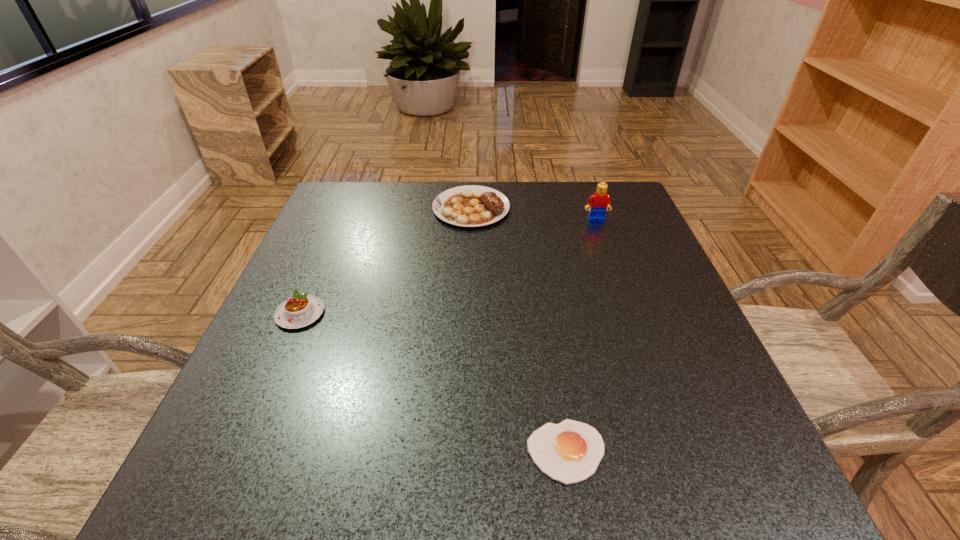
This screenshot has width=960, height=540. I want to click on the tallest object, so click(x=600, y=201).

Locate an element on the screen. The width and height of the screenshot is (960, 540). Lego is located at coordinates (600, 201).

Locate an element on the screen. steak is located at coordinates (469, 206).

The height and width of the screenshot is (540, 960). In order to click on the leftmost object in this screenshot , I will do point(298,311).

You are a GUI agent. You are given a task and a screenshot of the screen. Output one action in this format:
    pyautogui.click(x=<x>, y=<y>)
    Task: Click on the third tallest object
    
    Given the screenshot: What is the action you would take?
    pyautogui.click(x=298, y=311)

The width and height of the screenshot is (960, 540). What are the coordinates of `egg yolk` in the screenshot? It's located at (569, 452).

At what (x,y) coordinates should I click in order to perform the action: click on the nearest object. Please return your answer as a coordinate pair (x, y). The height and width of the screenshot is (540, 960). Looking at the image, I should click on (569, 452).

Identify the location of free space located 0.120m on the front-facing side of the Lego. tap(608, 252).

Where is `free location located on the front of the steak`? free location located on the front of the steak is located at coordinates (468, 309).

This screenshot has width=960, height=540. Identify the location of blank space located on the right of the leftmost object. (499, 314).